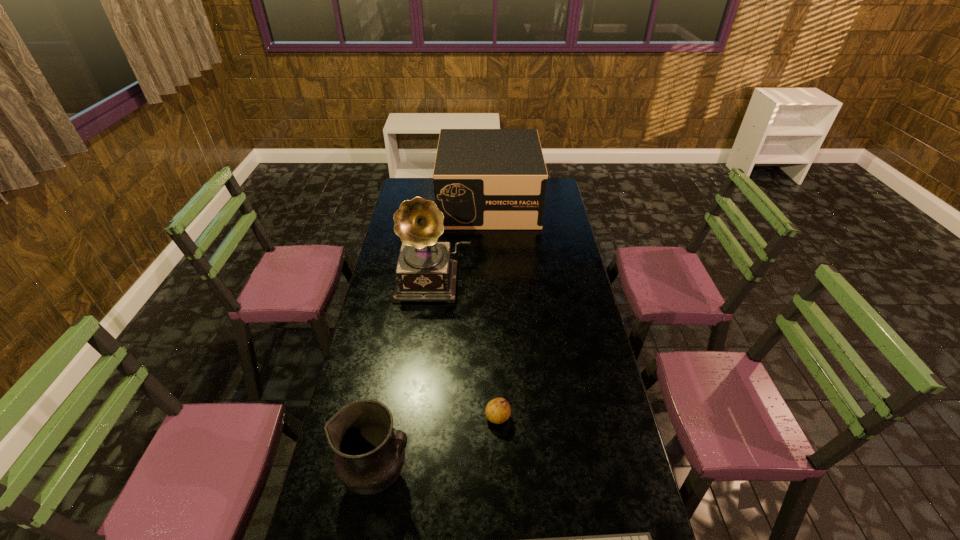
Where is `free spot located on the back of the third nearest object`? free spot located on the back of the third nearest object is located at coordinates (496, 381).

Locate an element on the screen. This screenshot has width=960, height=540. object located at the far edge is located at coordinates (484, 179).

The height and width of the screenshot is (540, 960). In order to click on record player that is at the left edge in this screenshot , I will do `click(425, 272)`.

The image size is (960, 540). Find the location of `pitcher present at the left edge`. pitcher present at the left edge is located at coordinates (369, 455).

Locate an element on the screen. object that is at the right edge is located at coordinates (484, 179).

The width and height of the screenshot is (960, 540). In order to click on object that is at the far right corner in this screenshot , I will do `click(484, 179)`.

Find the location of a particular element. This screenshot has height=540, width=960. vacant space at the left edge of the desktop is located at coordinates (369, 344).

Locate an element on the screen. The image size is (960, 540). vacant area at the right edge is located at coordinates (611, 530).

Locate an element on the screen. The image size is (960, 540). free space between the tallest object and the farthest object is located at coordinates (462, 241).

Where is `vacant point located between the fourth nearest object and the second nearest object`? Image resolution: width=960 pixels, height=540 pixels. vacant point located between the fourth nearest object and the second nearest object is located at coordinates (406, 378).